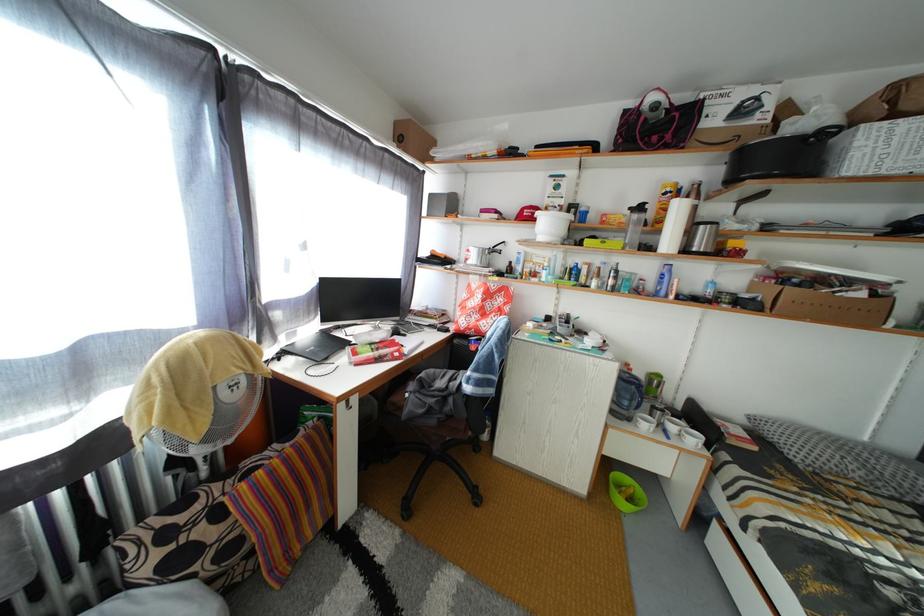
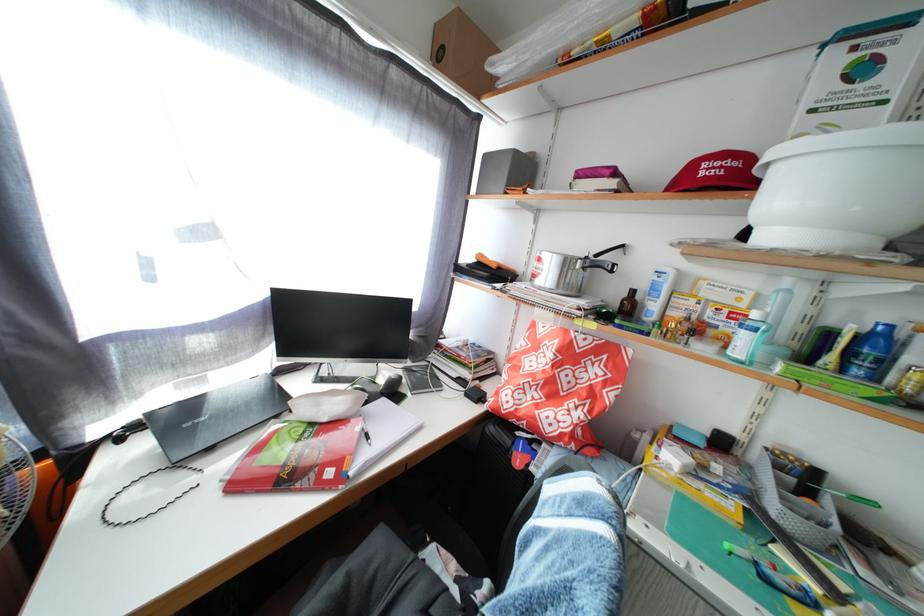
The point at (x=580, y=286) is marked in the first image. Where is the corresponding point in the second image?

(866, 378)